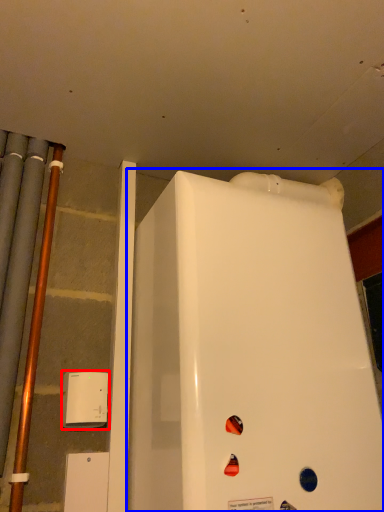
Question: Which of the following is the closest to the observer, appliance (highlighted by a red box) or refrigerator (highlighted by a blue box)?

Choices:
 (A) appliance
 (B) refrigerator

Answer: (B)